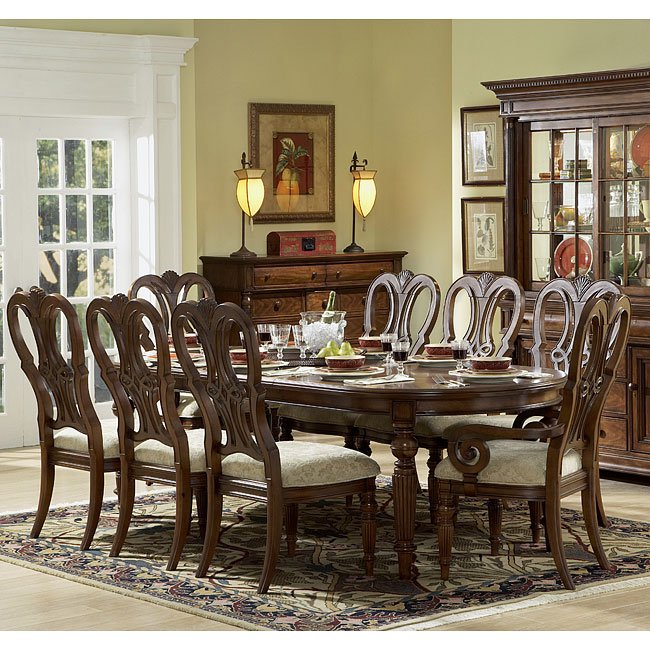
Where is `chairs`? chairs is located at coordinates (278, 478), (170, 437), (84, 411), (177, 289), (393, 289), (474, 291), (573, 302), (575, 372).